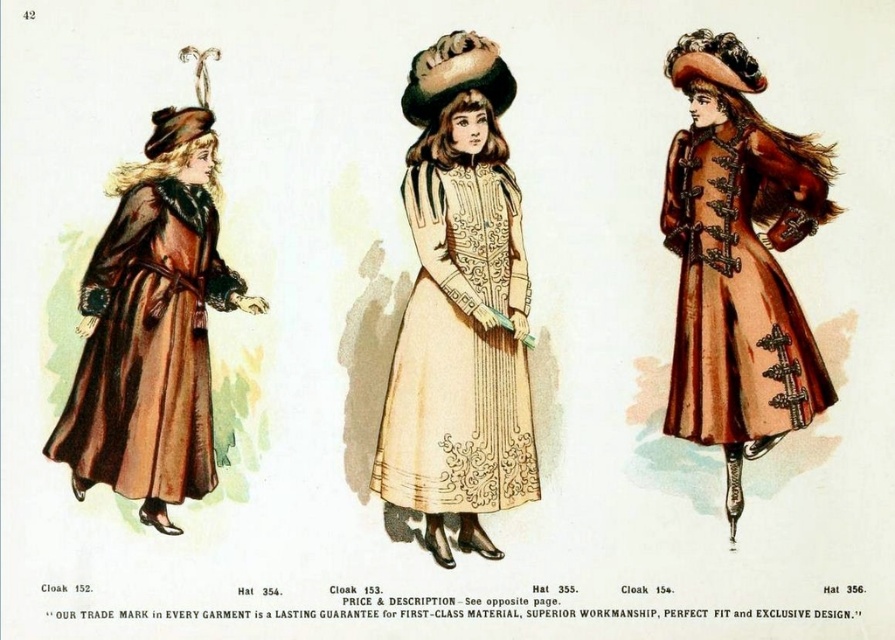
Question: Does matte brown coat at center have a lesser width compared to beige embroidered dress at center?

Choices:
 (A) no
 (B) yes

Answer: (A)

Question: Can you confirm if matte brown coat at center is bigger than beige embroidered dress at center?

Choices:
 (A) no
 (B) yes

Answer: (B)

Question: Estimate the real-world distances between objects in this image. Which object is closer to the beige embroidered dress at center?

Choices:
 (A) brown fur coat at left
 (B) matte brown coat at center

Answer: (B)

Question: Which object is positioned closest to the matte brown coat at center?

Choices:
 (A) brown fur coat at left
 (B) beige embroidered dress at center

Answer: (B)

Question: Considering the relative positions of matte brown coat at center and brown fur coat at left in the image provided, where is matte brown coat at center located with respect to brown fur coat at left?

Choices:
 (A) above
 (B) below

Answer: (A)

Question: Which point is farther to the camera?

Choices:
 (A) matte brown coat at center
 (B) brown fur coat at left

Answer: (A)